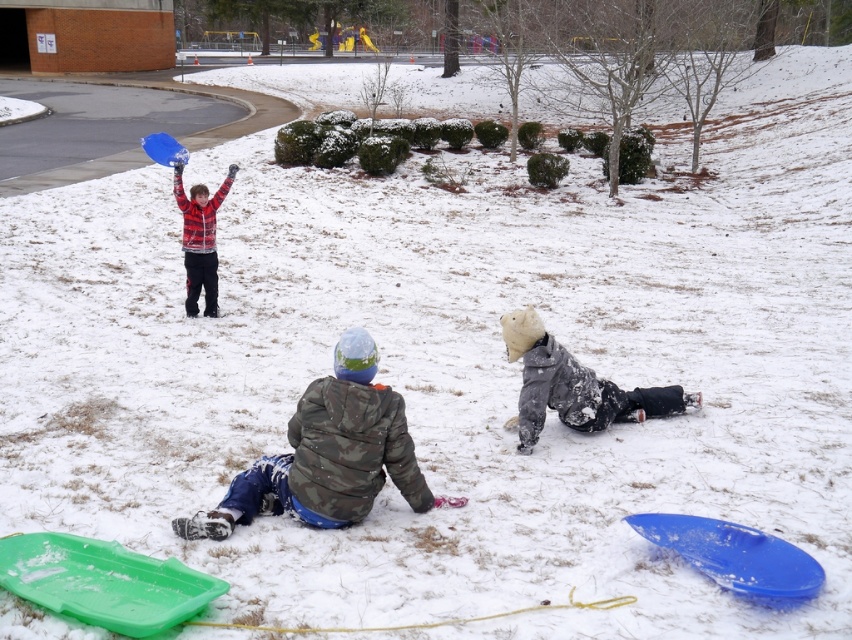
Is camo jacket at lower center wider than snow-covered winter coat at lower right?

Indeed, camo jacket at lower center has a greater width compared to snow-covered winter coat at lower right.

Which is more to the right, camo jacket at lower center or snow-covered winter coat at lower right?

snow-covered winter coat at lower right

At what (x,y) coordinates should I click in order to perform the action: click on camo jacket at lower center. Please return your answer as a coordinate pair (x, y). The width and height of the screenshot is (852, 640). Looking at the image, I should click on (327, 454).

Between snow-covered winter coat at lower right and plaid flannel shirt at upper left, which one has less height?

snow-covered winter coat at lower right is shorter.

Is snow-covered winter coat at lower right thinner than plaid flannel shirt at upper left?

In fact, snow-covered winter coat at lower right might be wider than plaid flannel shirt at upper left.

The width and height of the screenshot is (852, 640). Identify the location of snow-covered winter coat at lower right. (574, 385).

Is point (355, 520) farther from camera compared to point (229, 176)?

No, (355, 520) is closer to viewer.

Is camo jacket at lower center below plaid flannel shirt at upper left?

Yes, camo jacket at lower center is below plaid flannel shirt at upper left.

Between point (314, 480) and point (193, 260), which one is positioned behind?

The point (193, 260) is more distant.

This screenshot has height=640, width=852. Find the location of `camo jacket at lower center`. camo jacket at lower center is located at coordinates (327, 454).